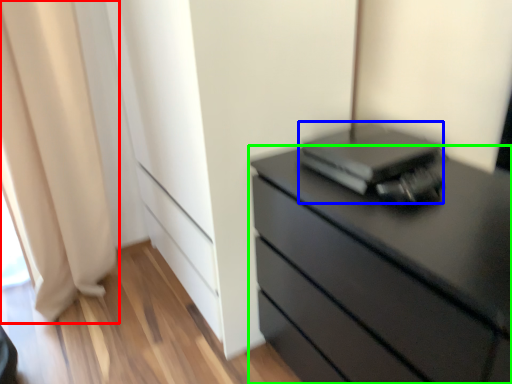
Question: Which is farther away from curtain (highlighted by a red box)? computer (highlighted by a blue box) or chest of drawers (highlighted by a green box)?

Choices:
 (A) computer
 (B) chest of drawers

Answer: (B)